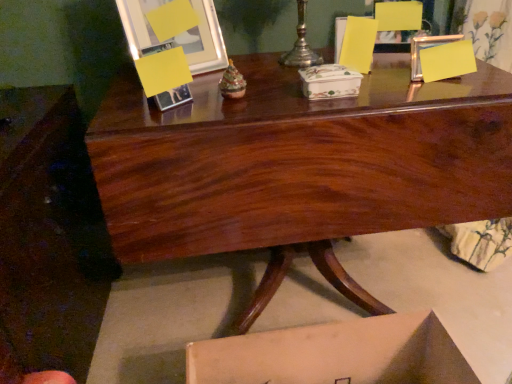
Find the location of `unoccupied area in front of porcelain floral box at center`. unoccupied area in front of porcelain floral box at center is located at coordinates (330, 108).